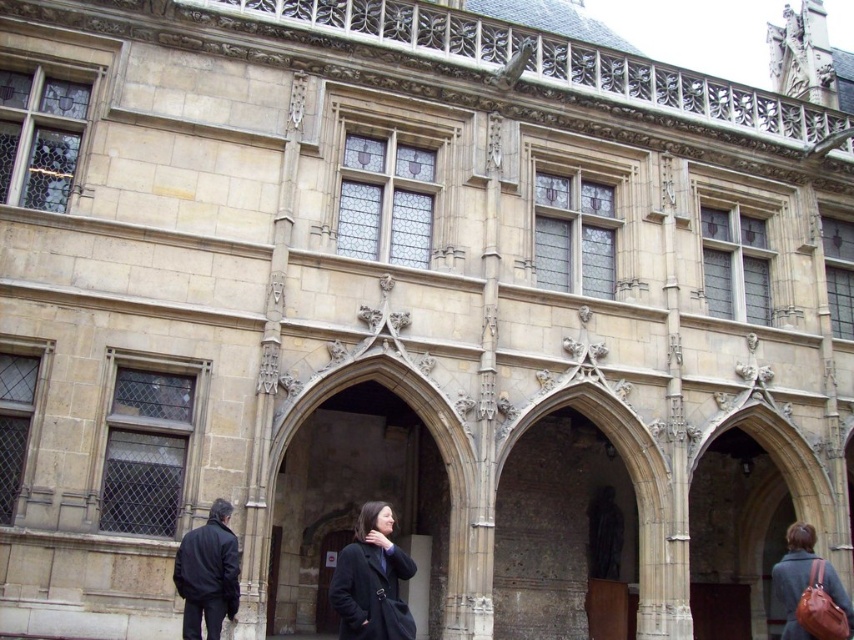
Who is more forward, (375, 636) or (788, 632)?

Positioned in front is point (375, 636).

Between matte black coat at center and brown leather bag at lower right, which one is positioned lower?

Positioned lower is brown leather bag at lower right.

Locate an element on the screen. The width and height of the screenshot is (854, 640). matte black coat at center is located at coordinates (369, 577).

Does stone archway at center have a greater width compared to stone textured archway at center?

Indeed, stone archway at center has a greater width compared to stone textured archway at center.

Does stone archway at center appear over stone textured archway at center?

Yes, stone archway at center is above stone textured archway at center.

At what (x,y) coordinates should I click in order to perform the action: click on stone archway at center. Please return your answer as a coordinate pair (x, y). Looking at the image, I should click on (366, 488).

Who is lower down, stone textured archway at center or black matte jacket at lower left?

stone textured archway at center

Can you confirm if stone textured archway at center is shorter than black matte jacket at lower left?

No, stone textured archway at center is not shorter than black matte jacket at lower left.

Is point (551, 449) positioned after point (191, 564)?

Yes, it is.

The height and width of the screenshot is (640, 854). In order to click on stone textured archway at center in this screenshot , I will do `click(564, 525)`.